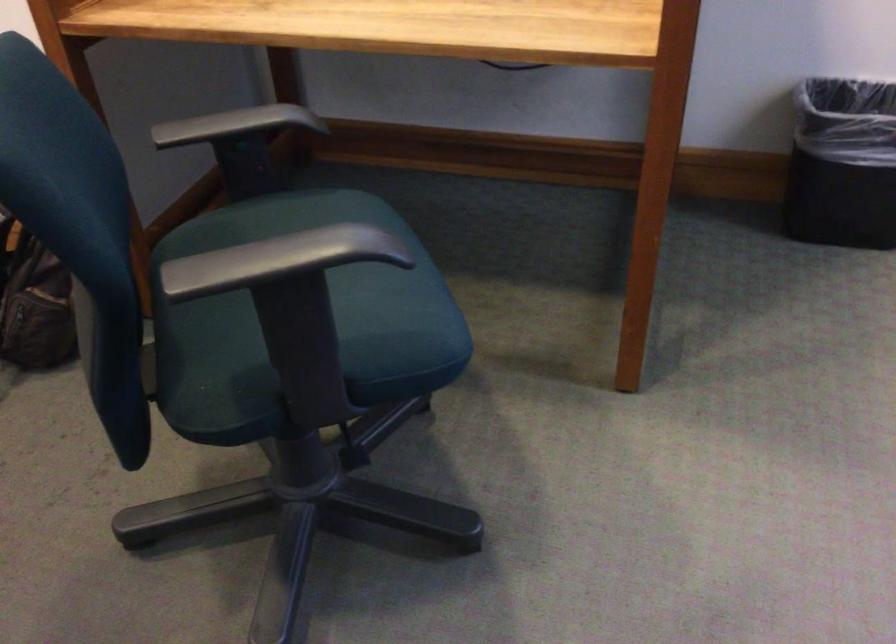
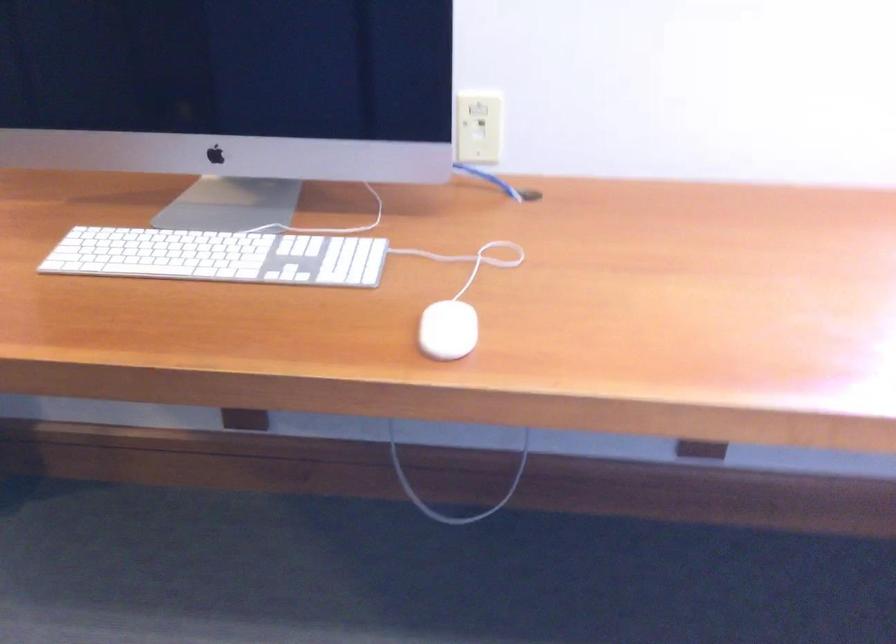
Question: In a continuous first-person perspective shot, in which direction is the camera moving?

Choices:
 (A) Left
 (B) Right
 (C) Forward
 (D) Backward

Answer: (B)